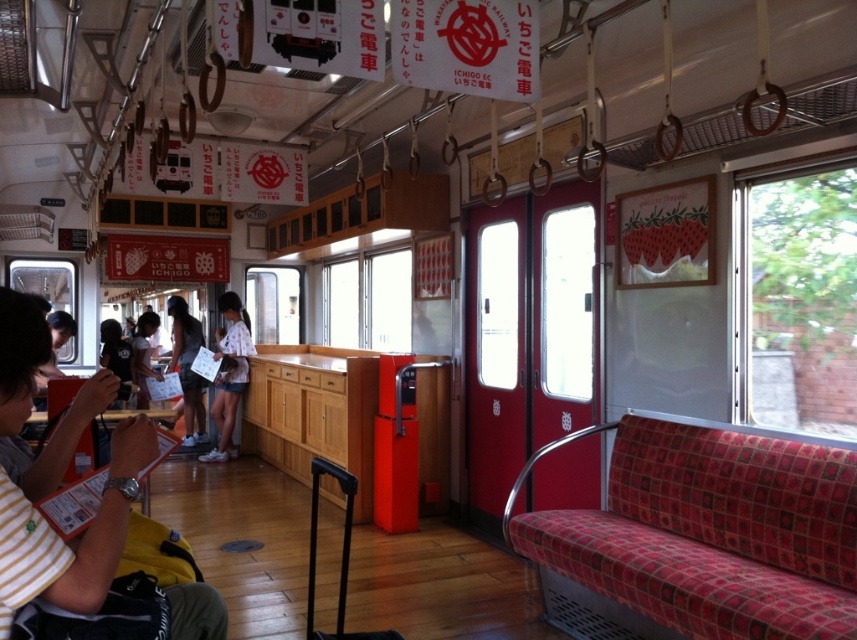
Looking at this image, you are a passenger in the train carriage and want to place both the white cotton shirt at center and the dark gray fabric shirt at center into a single overhead compartment. The compartment has a height limit of 12 inches. Can both shirts fit vertically if stacked?

The white cotton shirt at center is smaller than the dark gray fabric shirt at center. If stacked vertically, their combined height may exceed the 12 inch limit. Check the total height of both shirts together before stacking.

You are a passenger standing in the train carriage and want to sit down. Which object, the red patterned fabric seat at right or the light brown fabric shirt at center left, is closer to you?

The red patterned fabric seat at right is closer to you because it is positioned under the light brown fabric shirt at center left, indicating it is lower and nearer in the scene.